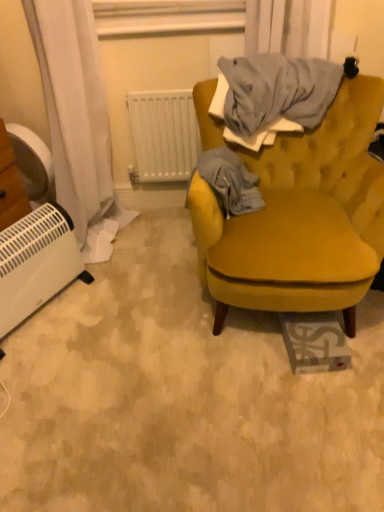
Question: Is velvet mustard yellow armchair at center inside or outside of gray cotton blanket at upper right?

Choices:
 (A) outside
 (B) inside

Answer: (A)

Question: Considering the positions of point (258, 289) and point (236, 201), is point (258, 289) closer or farther from the camera than point (236, 201)?

Choices:
 (A) farther
 (B) closer

Answer: (B)

Question: Which of these objects is positioned closest to the gray cotton blanket at upper right?

Choices:
 (A) white plastic heater at lower left
 (B) white plastic radiator at upper center
 (C) velvet mustard yellow armchair at center
 (D) white plastic fan at left

Answer: (C)

Question: Which object is the farthest from the velvet mustard yellow armchair at center?

Choices:
 (A) white plastic fan at left
 (B) white plastic radiator at upper center
 (C) gray cotton blanket at upper right
 (D) white plastic heater at lower left

Answer: (A)